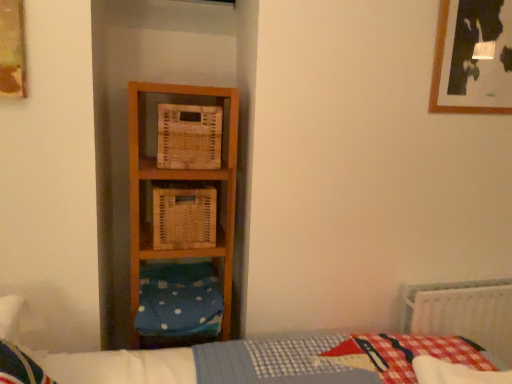
Question: From the image's perspective, is wooden picture frame at upper right, positioned as the 1th picture frame in right-to-left order, on blue polka dot fabric at lower left?

Choices:
 (A) yes
 (B) no

Answer: (A)

Question: Is the depth of wooden picture frame at upper right, the 1th picture frame positioned from the back, less than that of blue polka dot fabric at lower left?

Choices:
 (A) yes
 (B) no

Answer: (A)

Question: Considering the relative positions of wooden picture frame at upper right, which is the 2th picture frame from left to right, and blue polka dot fabric at lower left in the image provided, is wooden picture frame at upper right, which is the 2th picture frame from left to right, to the left of blue polka dot fabric at lower left from the viewer's perspective?

Choices:
 (A) yes
 (B) no

Answer: (B)

Question: Is blue polka dot fabric at lower left surrounded by wooden picture frame at upper right, the 1th picture frame positioned from the back?

Choices:
 (A) yes
 (B) no

Answer: (B)

Question: Is wooden picture frame at upper right, the 1th picture frame positioned from the back, facing towards blue polka dot fabric at lower left?

Choices:
 (A) no
 (B) yes

Answer: (A)

Question: Would you say wooden picture frame at upper right, which ranks as the second picture frame in front-to-back order, is outside blue polka dot fabric at lower left?

Choices:
 (A) yes
 (B) no

Answer: (A)

Question: Is white plastic radiator at lower right surrounded by blue polka dot fabric at lower left?

Choices:
 (A) no
 (B) yes

Answer: (A)

Question: Is blue polka dot fabric at lower left positioned far away from white plastic radiator at lower right?

Choices:
 (A) yes
 (B) no

Answer: (B)

Question: Can you confirm if blue polka dot fabric at lower left is shorter than white plastic radiator at lower right?

Choices:
 (A) yes
 (B) no

Answer: (A)

Question: From the image's perspective, does blue polka dot fabric at lower left appear lower than white plastic radiator at lower right?

Choices:
 (A) no
 (B) yes

Answer: (A)

Question: Is blue polka dot fabric at lower left closer to the viewer compared to white plastic radiator at lower right?

Choices:
 (A) no
 (B) yes

Answer: (B)

Question: Considering the relative sizes of blue polka dot fabric at lower left and white plastic radiator at lower right in the image provided, is blue polka dot fabric at lower left smaller than white plastic radiator at lower right?

Choices:
 (A) no
 (B) yes

Answer: (B)

Question: Does wooden picture frame at upper left, the first picture frame from the front, have a larger size compared to blue polka dot fabric at lower left?

Choices:
 (A) yes
 (B) no

Answer: (B)